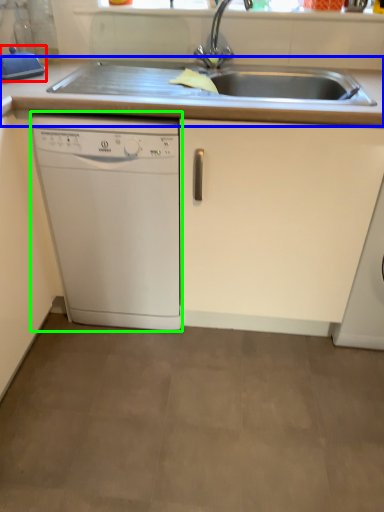
Question: Which is farther away from appliance (highlighted by a red box)? countertop (highlighted by a blue box) or home appliance (highlighted by a green box)?

Choices:
 (A) countertop
 (B) home appliance

Answer: (B)